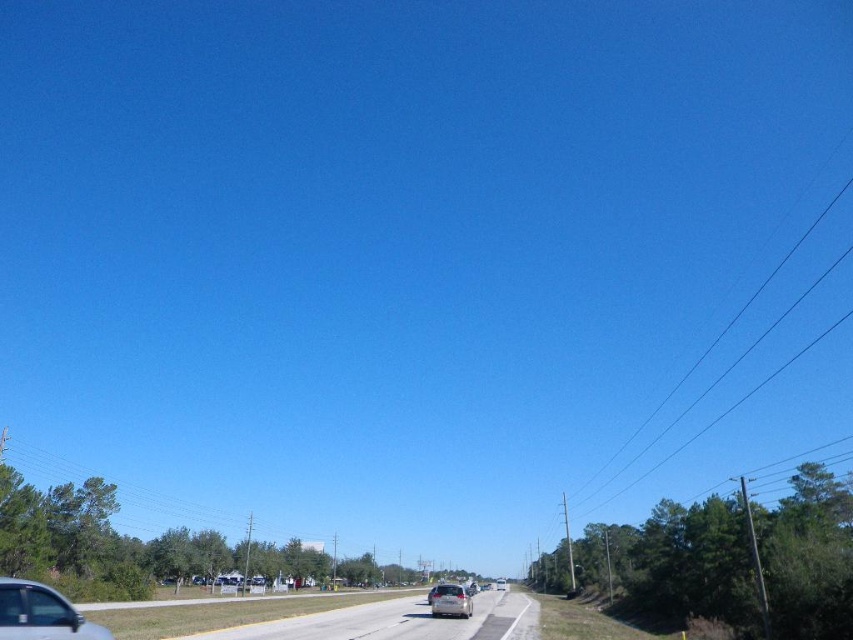
Question: Among these points, which one is nearest to the camera?

Choices:
 (A) (442, 605)
 (B) (0, 579)
 (C) (439, 637)

Answer: (B)

Question: Does gray asphalt highway at center come in front of satin silver sedan at center?

Choices:
 (A) yes
 (B) no

Answer: (A)

Question: Which object is the farthest from the silver metallic car at lower left?

Choices:
 (A) satin silver sedan at center
 (B) gray asphalt highway at center

Answer: (A)

Question: Estimate the real-world distances between objects in this image. Which object is closer to the gray asphalt highway at center?

Choices:
 (A) silver metallic car at lower left
 (B) satin silver sedan at center

Answer: (B)

Question: Is gray asphalt highway at center closer to the viewer compared to satin silver sedan at center?

Choices:
 (A) no
 (B) yes

Answer: (B)

Question: Where is gray asphalt highway at center located in relation to silver metallic car at lower left in the image?

Choices:
 (A) above
 (B) below

Answer: (B)